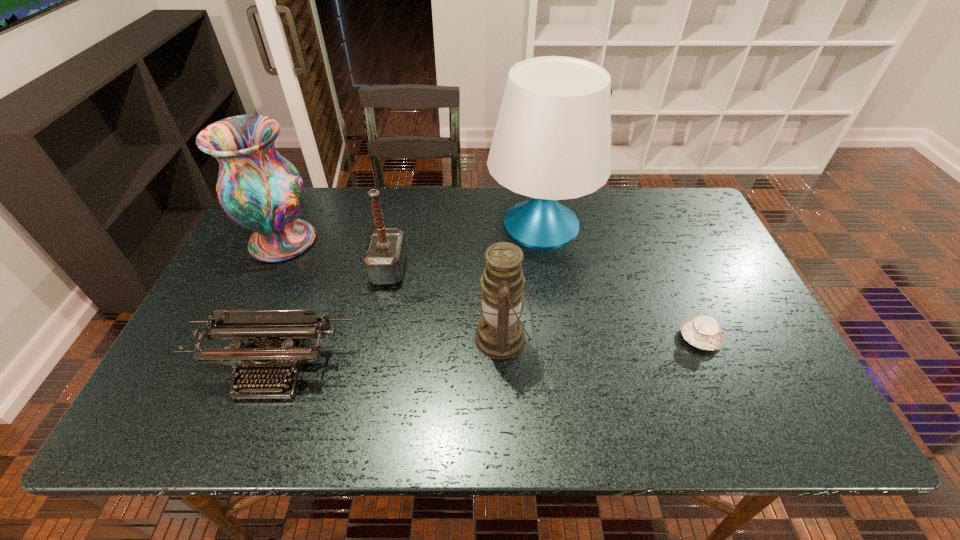
I want to click on object at the right edge, so click(x=703, y=332).

The width and height of the screenshot is (960, 540). In order to click on object at the far left corner in this screenshot , I will do (260, 190).

This screenshot has width=960, height=540. I want to click on object that is at the near left corner, so click(271, 348).

The image size is (960, 540). I want to click on vacant space at the far edge of the desktop, so click(318, 209).

The image size is (960, 540). What are the coordinates of `free point at the near edge` in the screenshot? It's located at (700, 416).

The image size is (960, 540). In order to click on blank space at the left edge of the desktop in this screenshot , I will do `click(176, 365)`.

Locate an element on the screen. vacant space at the right edge is located at coordinates (699, 259).

At what (x,y) coordinates should I click in order to perform the action: click on vacant space at the far right corner of the desktop. Please return your answer as a coordinate pair (x, y). The image size is (960, 540). Looking at the image, I should click on (700, 224).

In order to click on vacant area that lies between the typewriter and the vase in this screenshot , I will do `click(278, 305)`.

Find the location of `free spot between the tallest object and the hammer`. free spot between the tallest object and the hammer is located at coordinates (465, 246).